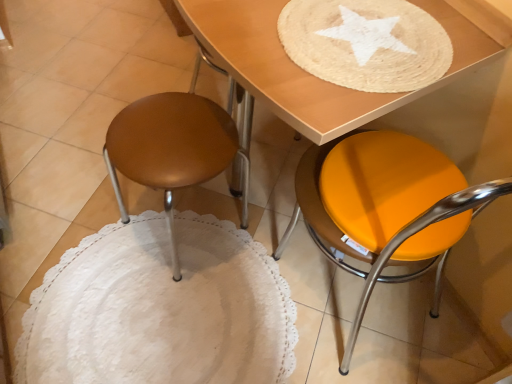
The height and width of the screenshot is (384, 512). I want to click on vacant space situated above wooden table at upper center (from a real-world perspective), so click(x=362, y=34).